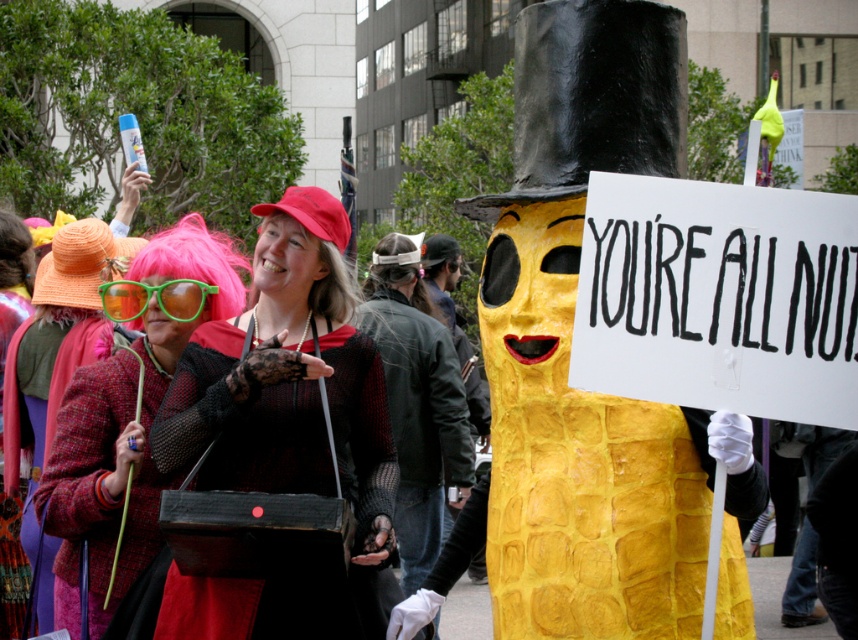
Question: Which object is positioned closest to the green plastic cane at left?

Choices:
 (A) green plastic goggles at center
 (B) matte red coat at center
 (C) matte black purse at center
 (D) matte pink wig at upper left

Answer: (D)

Question: Which is nearer to the matte pink wig at upper left?

Choices:
 (A) matte red coat at center
 (B) green plastic cane at left
 (C) green plastic goggles at center
 (D) matte black purse at center

Answer: (B)

Question: Can you confirm if matte red coat at center is bigger than green plastic goggles at center?

Choices:
 (A) yes
 (B) no

Answer: (A)

Question: In this image, where is matte black purse at center located relative to matte red coat at center?

Choices:
 (A) right
 (B) left

Answer: (A)

Question: Which point appears closest to the camera in this image?

Choices:
 (A) (82, 480)
 (B) (183, 410)
 (C) (240, 284)
 (D) (20, 376)

Answer: (B)

Question: Can you confirm if green plastic cane at left is positioned below matte red coat at center?

Choices:
 (A) yes
 (B) no

Answer: (A)